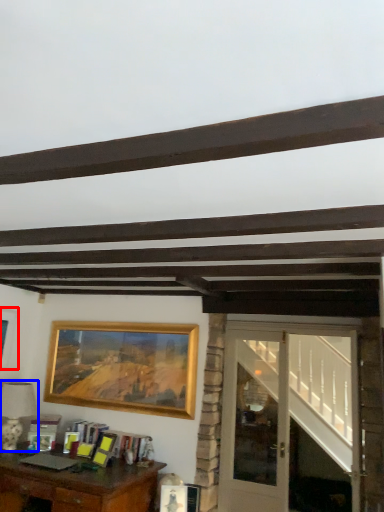
Question: Which of the following is the farthest to the observer, picture frame (highlighted by a red box) or lamp (highlighted by a blue box)?

Choices:
 (A) picture frame
 (B) lamp

Answer: (A)